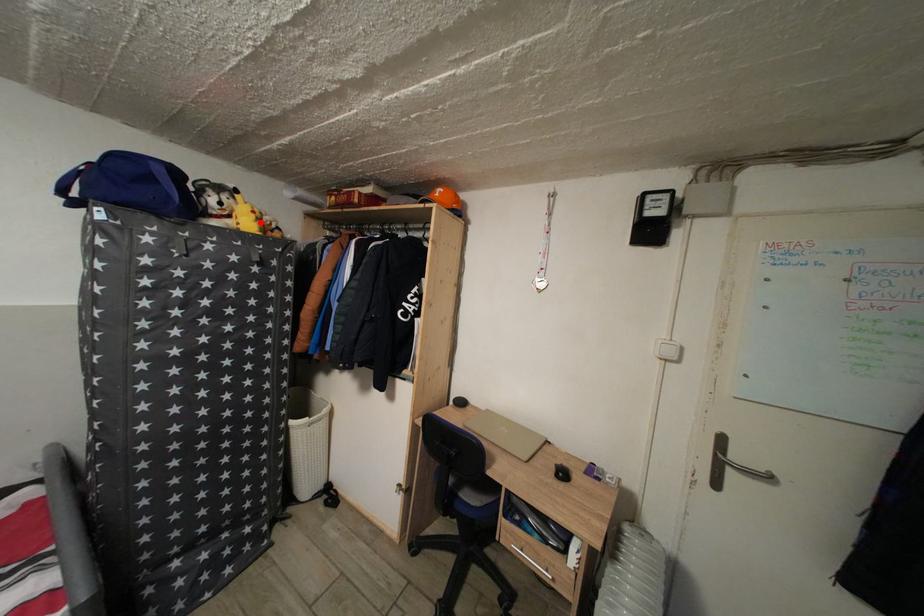
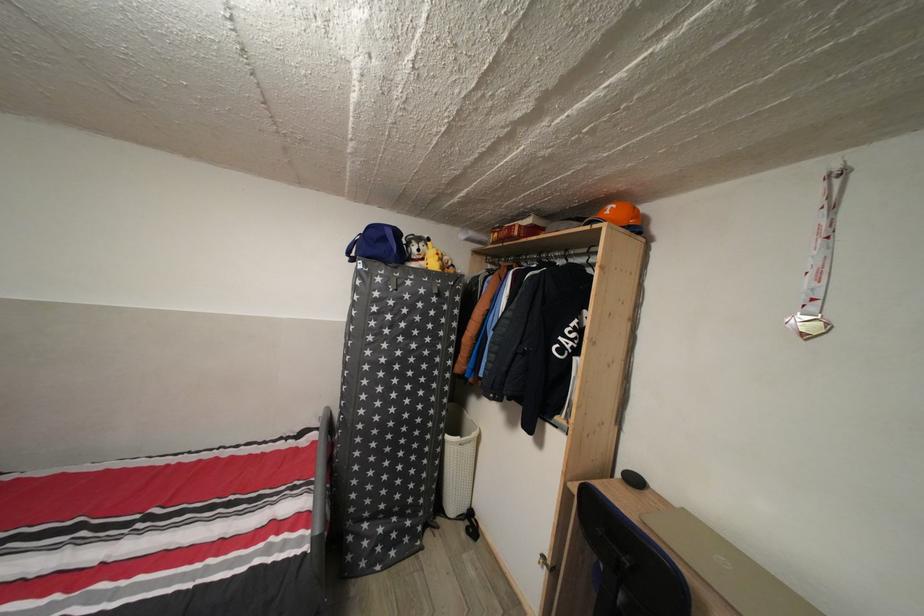
In the second image, find the point that corresponds to the highlighted location in the first image.

(444, 264)